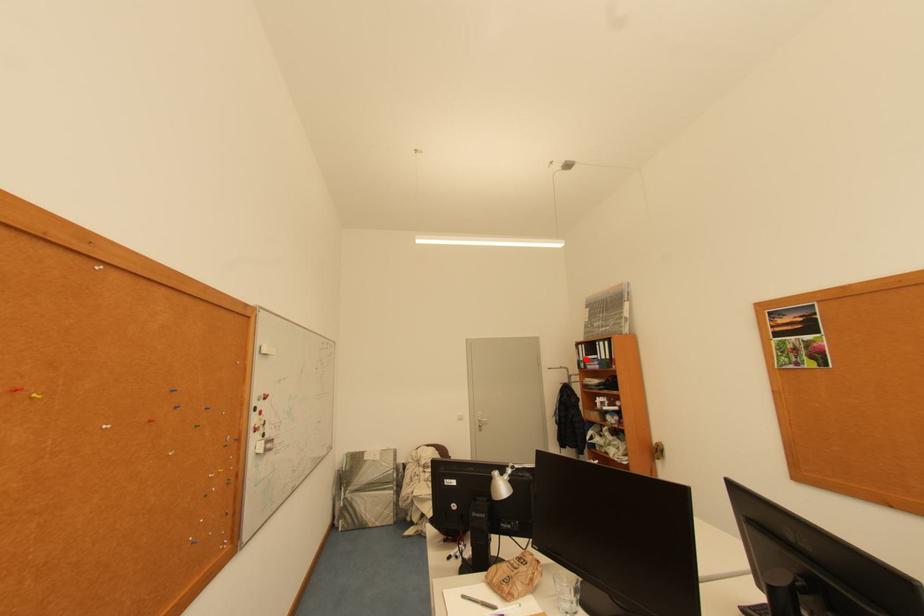
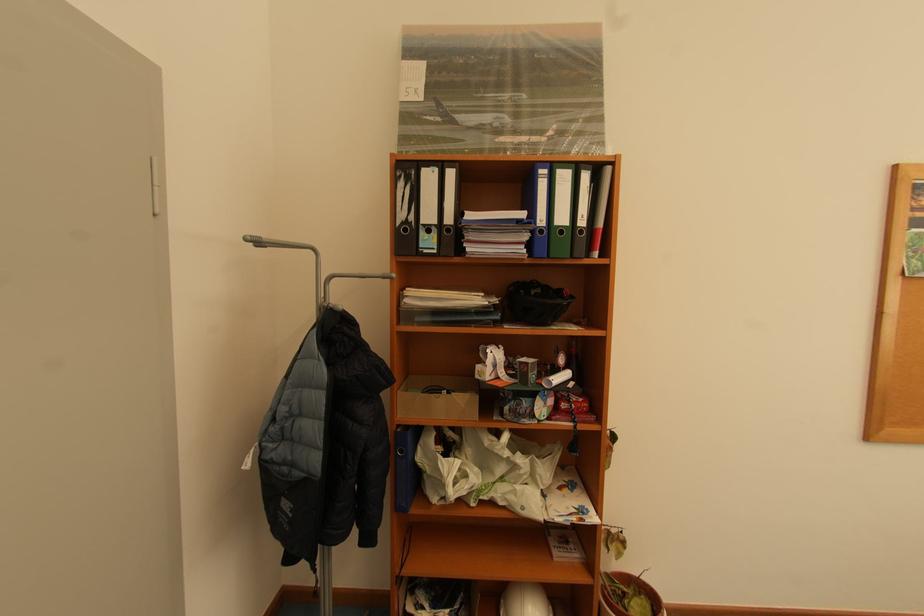
Question: A red point is marked in image1. In image2, is the corresponding 3D point closer to the camera or farther? Reply with the corresponding letter.

Choices:
 (A) The corresponding 3D point is closer.
 (B) The corresponding 3D point is farther.

Answer: (A)